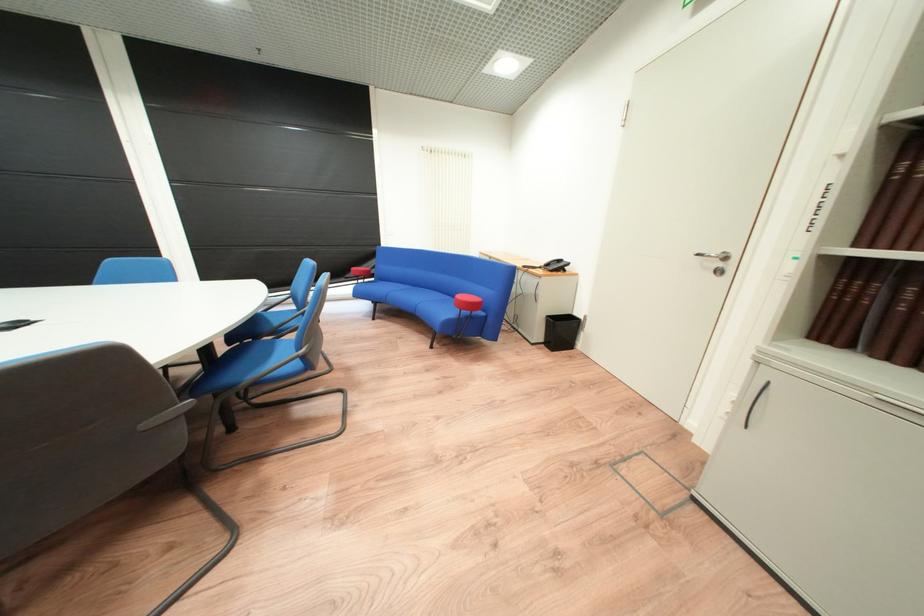
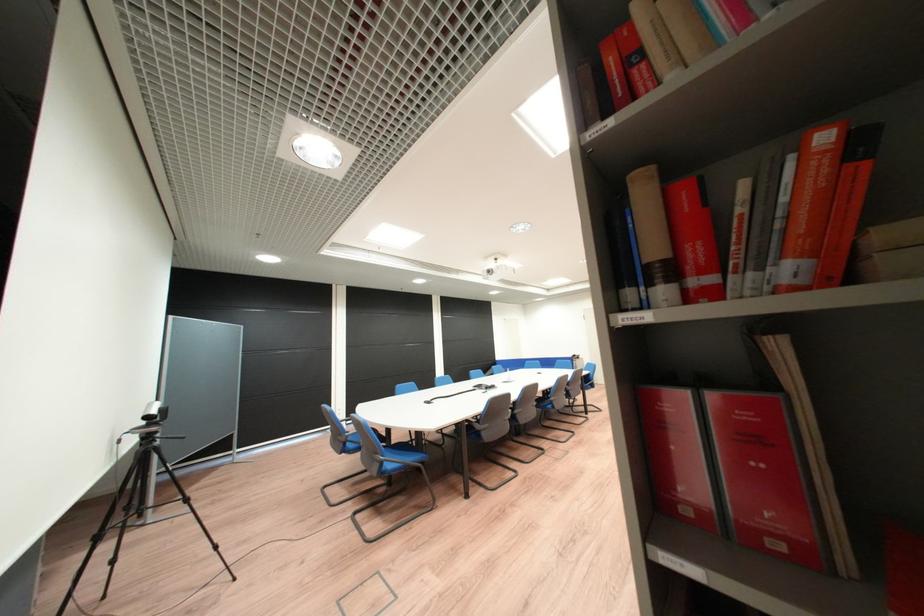
Question: I am providing you with two images of the same scene from different viewpoints. Please identify which objects are invisible in image2.

Choices:
 (A) red binder
 (B) small grey camera
 (C) orange leather ottoman
 (D) brown leather book

Answer: (D)